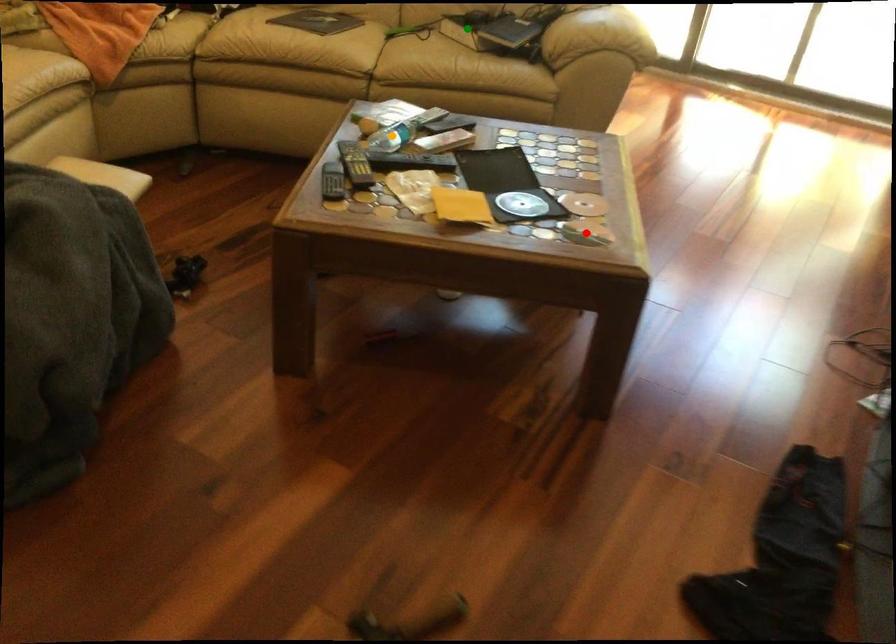
Order these from farthest to nearest:
orange point, red point, green point

green point, orange point, red point